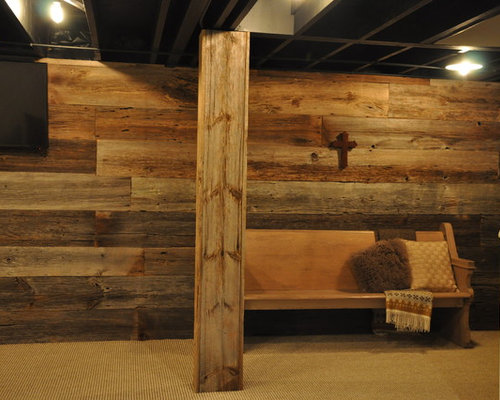
This screenshot has height=400, width=500. I want to click on pillar, so click(x=218, y=239).